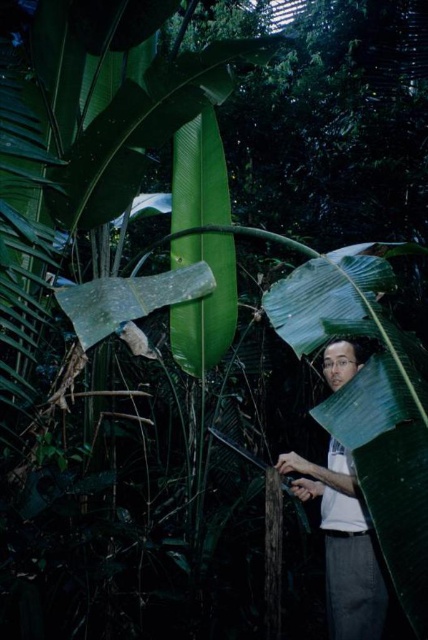
Is white matte shirt at right wider than green rough textured leaf at center?

No.

Between white matte shirt at right and green rough textured leaf at center, which one is positioned lower?

Positioned lower is white matte shirt at right.

Which is in front, point (347, 472) or point (130, 294)?

Point (130, 294)

The image size is (428, 640). Find the location of `white matte shirt at right`. white matte shirt at right is located at coordinates (342, 545).